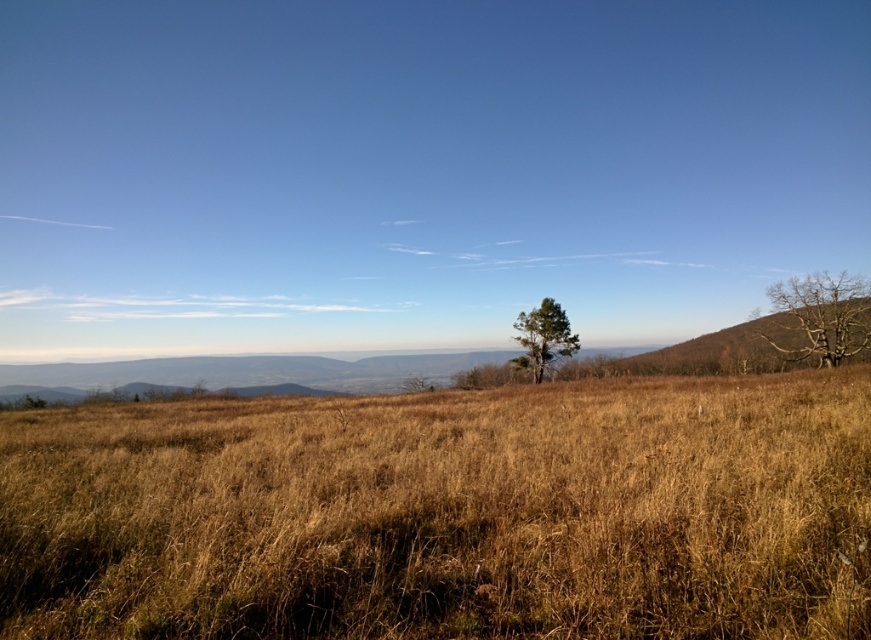
You are standing at the center of the grassland and want to place a small weather station. The manufacturer recommends placing it at least 1 meter away from any vegetation to avoid interference. Given that the dry grass at center is located at coordinates point 0.803, 0.514, can you safely place the weather station at point 0.5, 0.5?

The dry grass at center is located at point (447, 513). The distance between point (435, 320) and the dry grass at center is sqrt of sqrt of sqrt of ... Wait, I need to calculate the distance between the two points. Let me see. The coordinates are given as fractions, so maybe they are normalized between 0 and 1. The distance between two points in a plane is sqrt of the sum of the squares of the differences in each coordinate. So, the difference in the x coordinates is 0.803 minus 0.5, which is 0.303. The y.

You are a hiker who wants to take a photo of the dry grass at center and the bare wood tree at right. Which object will appear closer to the camera in the photo?

The dry grass at center appears closer to the camera because it is in front of the bare wood tree at right.